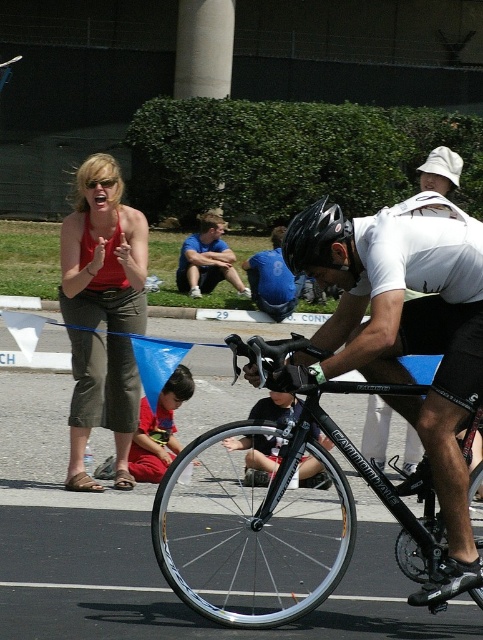
Is blue shirt at center to the right of blue jersey at center from the viewer's perspective?

No, blue shirt at center is not to the right of blue jersey at center.

Is blue shirt at center closer to the viewer compared to blue jersey at center?

No, it is behind blue jersey at center.

Locate an element on the screen. blue shirt at center is located at coordinates (207, 260).

Find the location of a particular element. The width and height of the screenshot is (483, 640). blue shirt at center is located at coordinates (x=207, y=260).

Does black matte helmet at center have a greater width compared to blue shirt at center?

In fact, black matte helmet at center might be narrower than blue shirt at center.

Can you confirm if black matte helmet at center is taller than blue shirt at center?

Yes, black matte helmet at center is taller than blue shirt at center.

Which is in front, point (323, 237) or point (197, 275)?

Positioned in front is point (323, 237).

The image size is (483, 640). I want to click on black matte helmet at center, so click(x=317, y=240).

Can you confirm if shiny black bike at center is shorter than blue jersey at center?

In fact, shiny black bike at center may be taller than blue jersey at center.

Measure the distance between shiny black bike at center and blue jersey at center.

→ shiny black bike at center and blue jersey at center are 9.07 meters apart from each other.

You are a GUI agent. You are given a task and a screenshot of the screen. Output one action in this format:
    pyautogui.click(x=<x>, y=<y>)
    Task: Click on the shiny black bike at center
    The width and height of the screenshot is (483, 640).
    Given the screenshot: What is the action you would take?
    pyautogui.click(x=278, y=525)

Locate an element on the screen. shiny black bike at center is located at coordinates (278, 525).